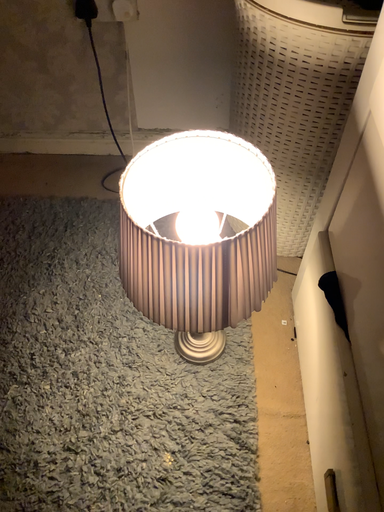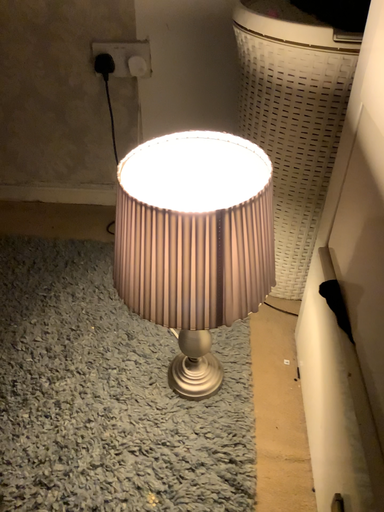
Question: How did the camera likely rotate when shooting the video?

Choices:
 (A) rotated downward
 (B) rotated upward

Answer: (B)